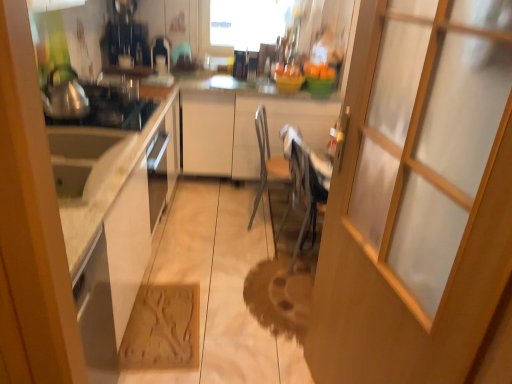
At what (x,y) coordinates should I click in order to perform the action: click on vacant space to the right of brushed metal tea pot at left. Please return your answer as a coordinate pair (x, y). The image size is (512, 384). Looking at the image, I should click on (106, 117).